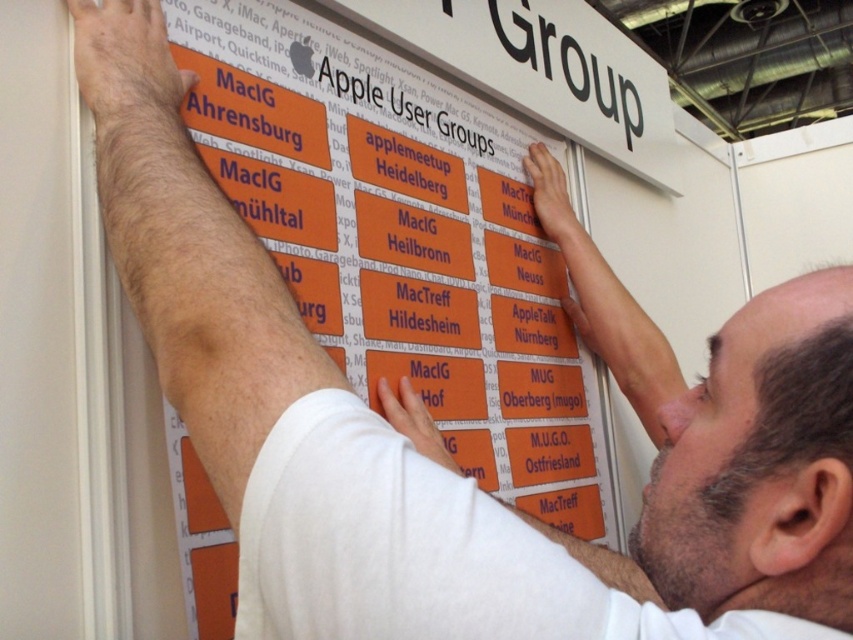
Question: Does orange matte sign at upper center appear over orange matte sign at center?

Choices:
 (A) yes
 (B) no

Answer: (B)

Question: Is orange matte sign at upper center to the left of orange matte sign at center from the viewer's perspective?

Choices:
 (A) yes
 (B) no

Answer: (B)

Question: Does orange matte sign at upper center come in front of orange matte sign at center?

Choices:
 (A) no
 (B) yes

Answer: (B)

Question: Which of the following is the farthest from the observer?

Choices:
 (A) (378, 88)
 (B) (396, 83)

Answer: (B)